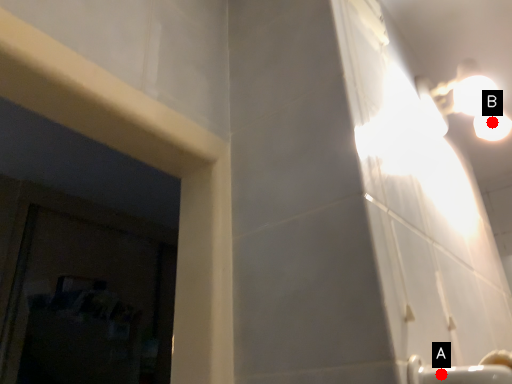
Question: Two points are circled on the image, labeled by A and B beside each circle. Among these points, which one is farthest from the camera?

Choices:
 (A) A is further
 (B) B is further

Answer: (B)